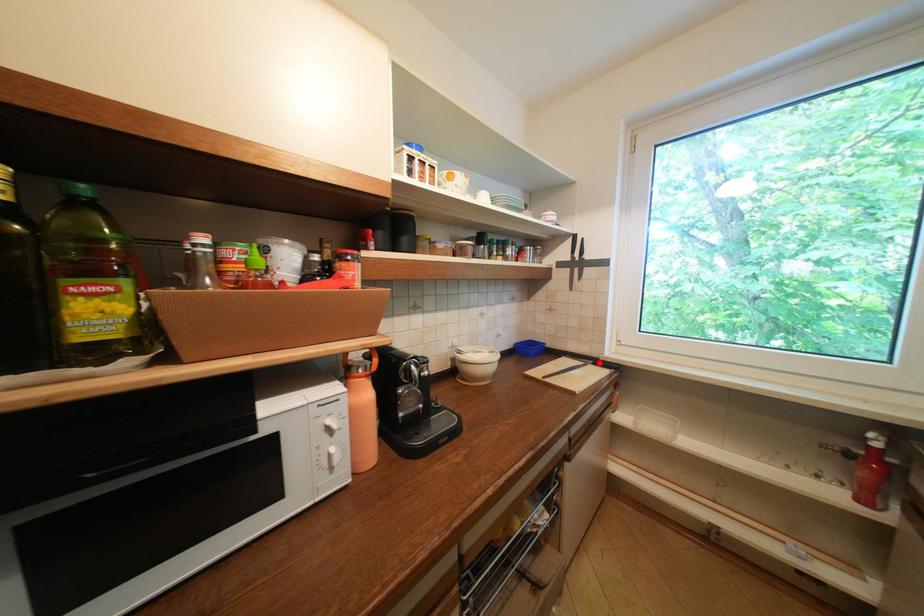
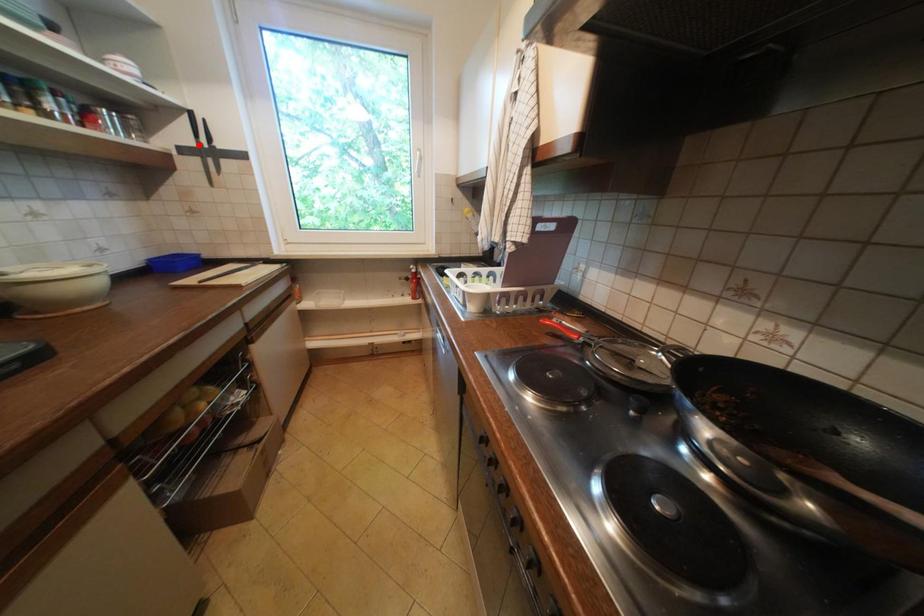
I am providing you with two images of the same scene from different viewpoints. A red point is marked on the first image and another point is marked on the second image. Do the highlighted points in image1 and image2 indicate the same real-world spot?

No